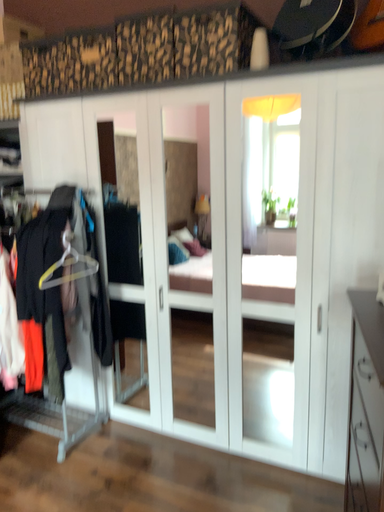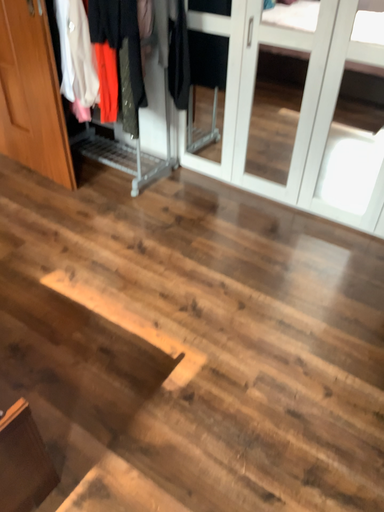
Question: How did the camera likely rotate when shooting the video?

Choices:
 (A) rotated upward
 (B) rotated downward

Answer: (B)